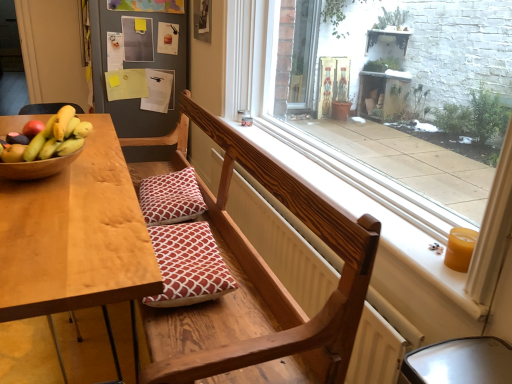
Identify the location of free space to the back side of yellow wax candle at right. (415, 230).